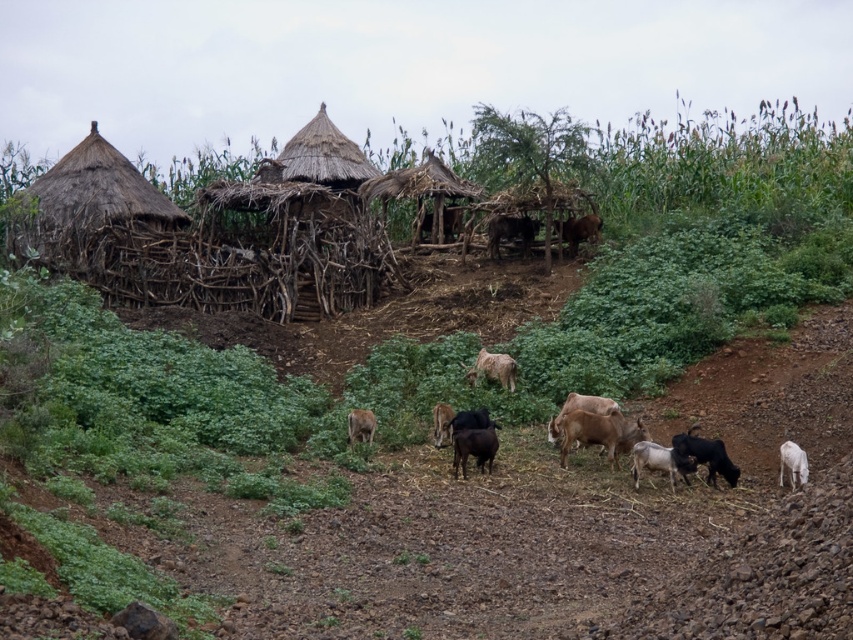
You are standing at the center of the settlement and see the point marked at (x=706, y=456). What animal is located at that point?

The point at (x=706, y=456) indicates a black woolen goat at lower right.

Consider the image. You are a farmer checking the health of your goats. You notice that the black woolen goat at lower right and the brown furry goat at center are both in need of attention. Which goat might require more space due to its size?

The brown furry goat at center is taller than the black woolen goat at lower right, so it might require more space due to its larger size.